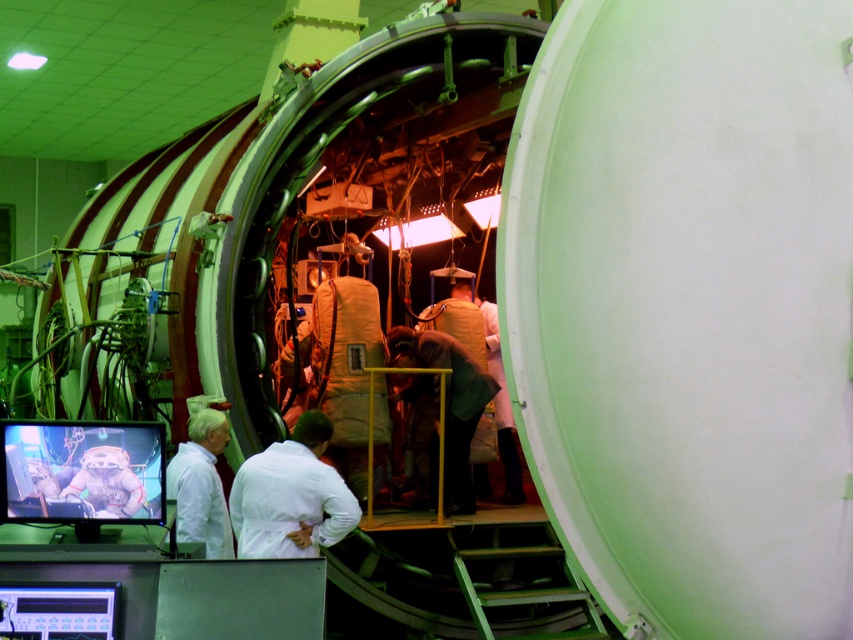
Is point (302, 413) farther from viewer compared to point (486, 392)?

No, it is not.

Is point (254, 532) more distant than point (466, 499)?

That is False.

I want to click on white matte lab coat at center, so click(291, 497).